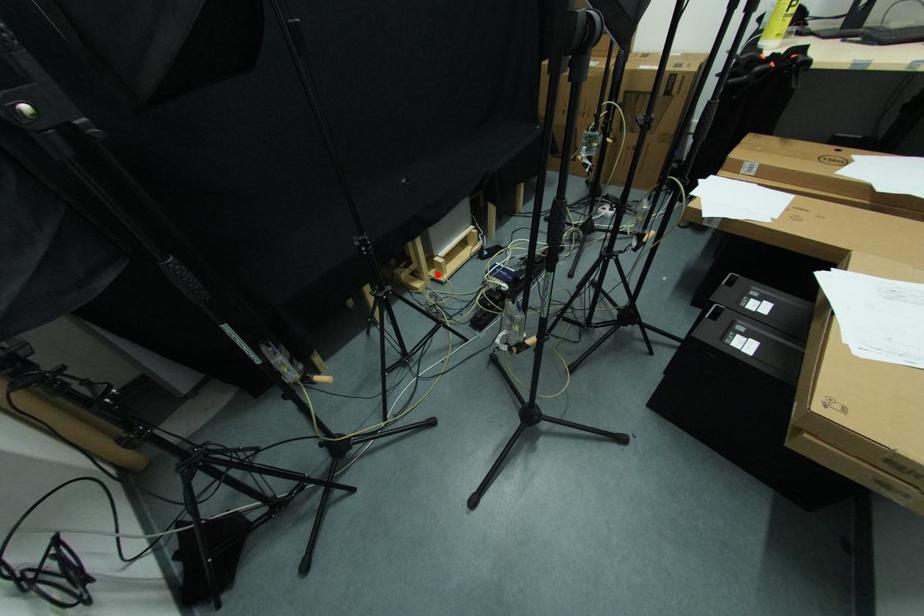
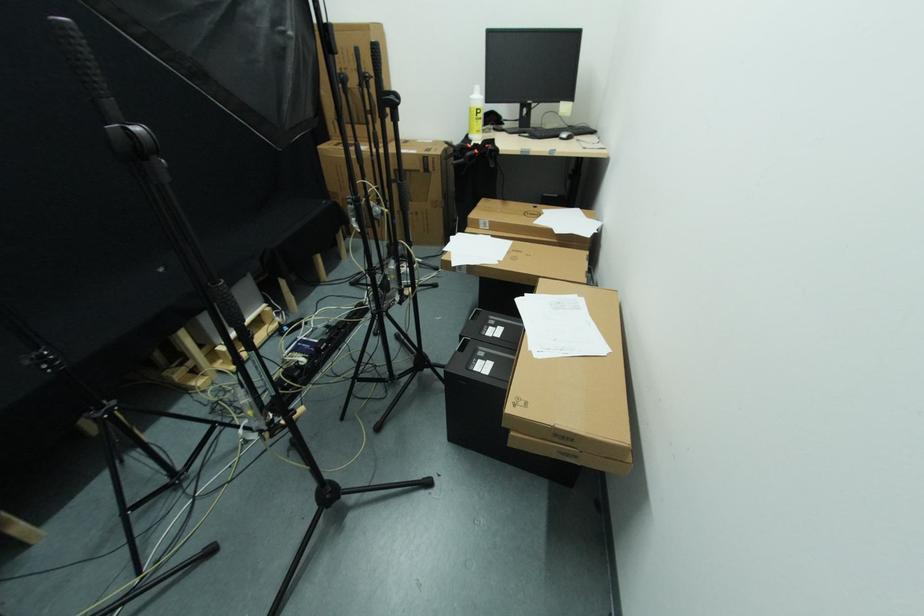
Locate, in the second image, the point that corresponds to the highlighted location in the first image.

(225, 365)